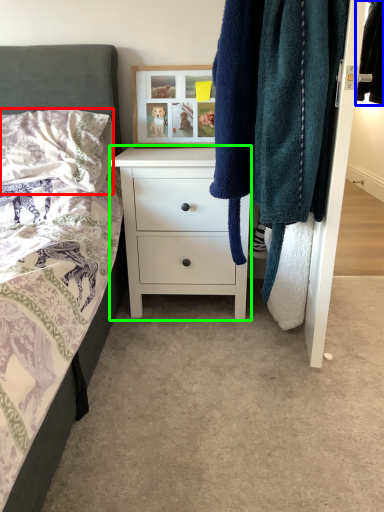
Question: Considering the real-world distances, which object is farthest from pillow (highlighted by a red box)? clothing (highlighted by a blue box) or chest of drawers (highlighted by a green box)?

Choices:
 (A) clothing
 (B) chest of drawers

Answer: (A)